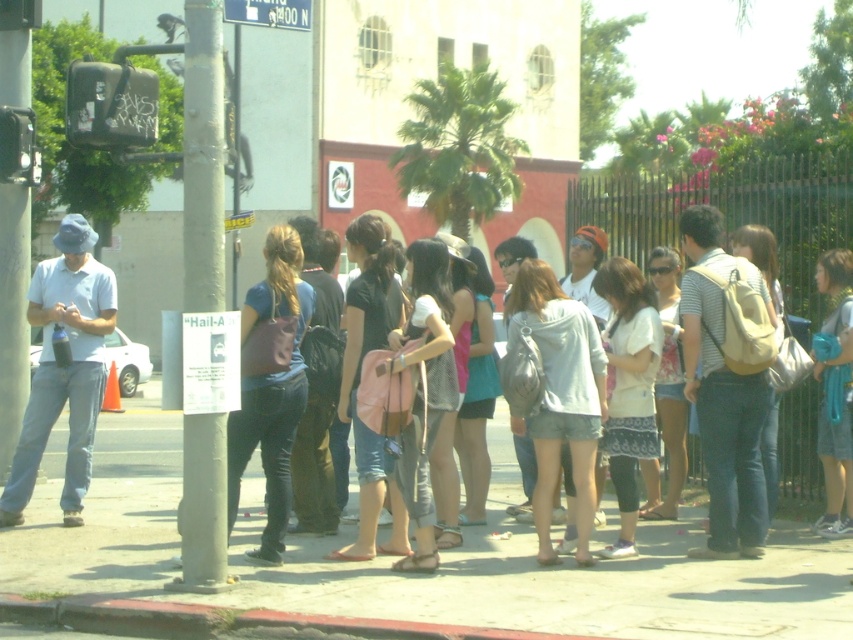
You are standing on the sidewalk in the street scene and want to know what material the ground under your feet is made of. According to the image, what is the material of the ground at the point labeled as point (422,573)?

The point (422,573) corresponds to smooth concrete sidewalk at center, so the material is smooth concrete.

You are a delivery person who needs to place a small box on the ground. You see the smooth concrete sidewalk at center and the matte pink backpack at center. Which object is lower to the ground so you can place the box there?

The smooth concrete sidewalk at center is not as tall as the matte pink backpack at center, so the sidewalk is lower to the ground. You can place the box on the smooth concrete sidewalk at center.

You are a delivery person carrying a package and need to place it on the curb. You see the matte pink backpack at center and the red concrete curb at lower center. Which object is closer to you as you stand in the street?

The matte pink backpack at center is closer to you because the red concrete curb at lower center is behind it.